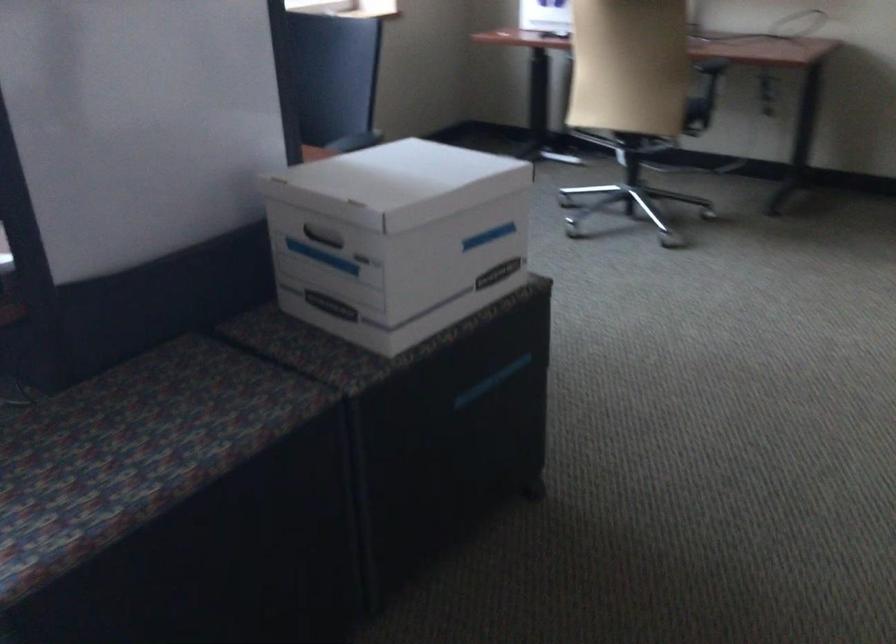
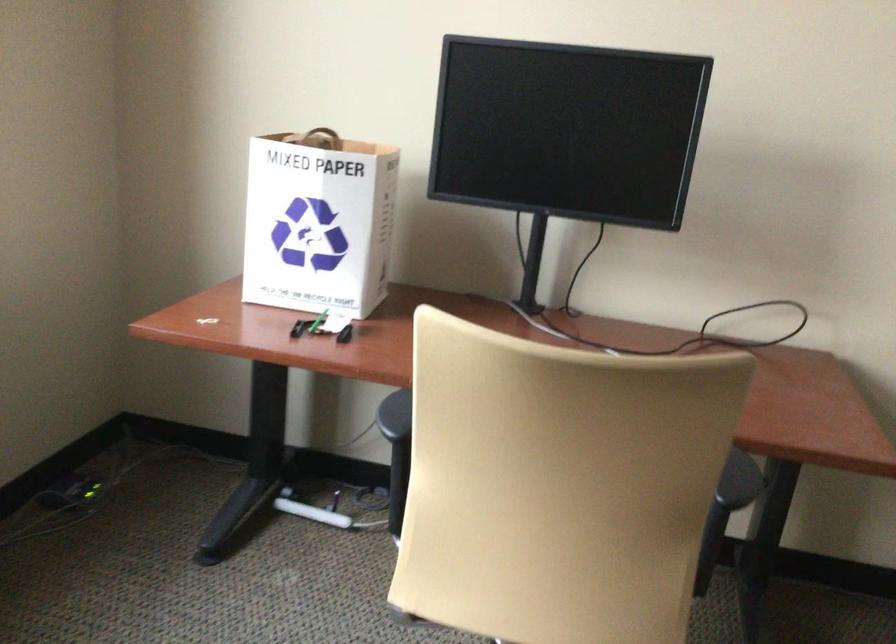
Question: The images are taken continuously from a first-person perspective. In which direction are you moving?

Choices:
 (A) Left
 (B) Right
 (C) Forward
 (D) Backward

Answer: (C)